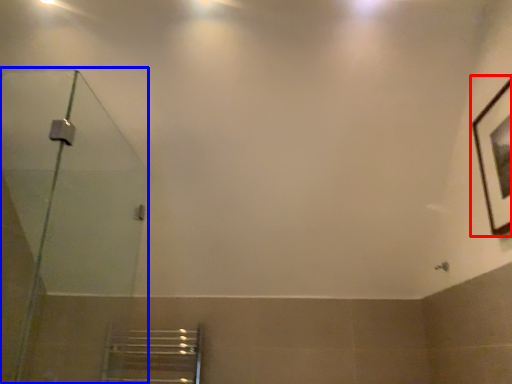
Question: Among these objects, which one is nearest to the camera, picture frame (highlighted by a red box) or shower door (highlighted by a blue box)?

Choices:
 (A) picture frame
 (B) shower door

Answer: (B)